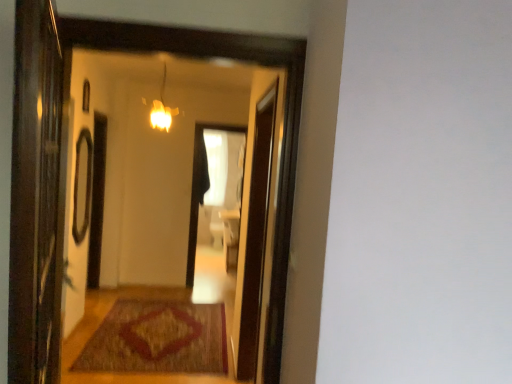
This screenshot has width=512, height=384. In order to click on free space above matte wooden mirror at center (from a real-world perspective) in this screenshot , I will do `click(172, 25)`.